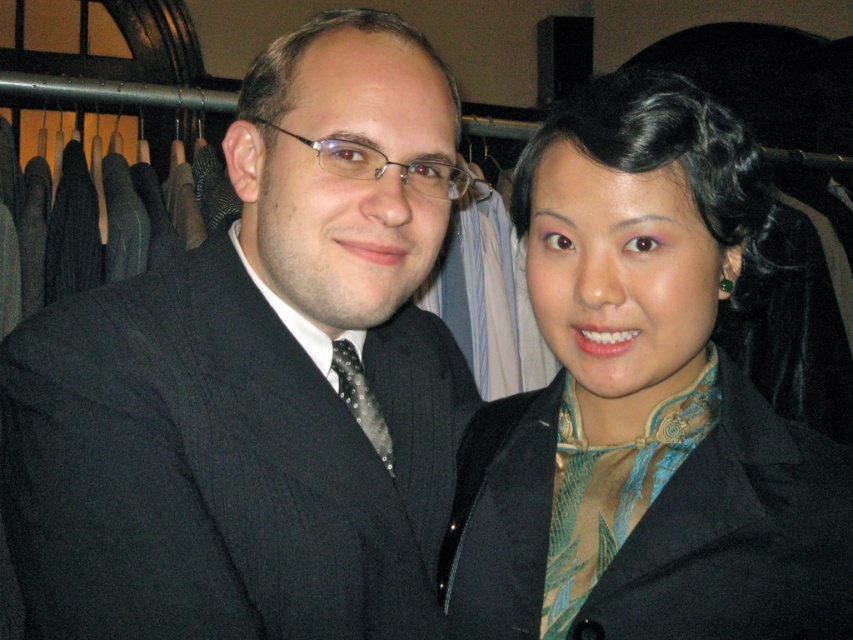
You are a customer in a clothing store looking for a black outfit. You see the matte black suit at center and the matte black coat at right. Which one is positioned lower in the image?

The matte black suit at center is located below the matte black coat at right, so it is positioned lower in the image.

You are a customer in a store and you see the matte black coat at right. You want to try it on but you are standing 20 inches away from it. Can you reach it without moving closer?

The matte black coat at right is 23.78 inches away from viewer, so you are 3.78 inches too far to reach it without moving closer.